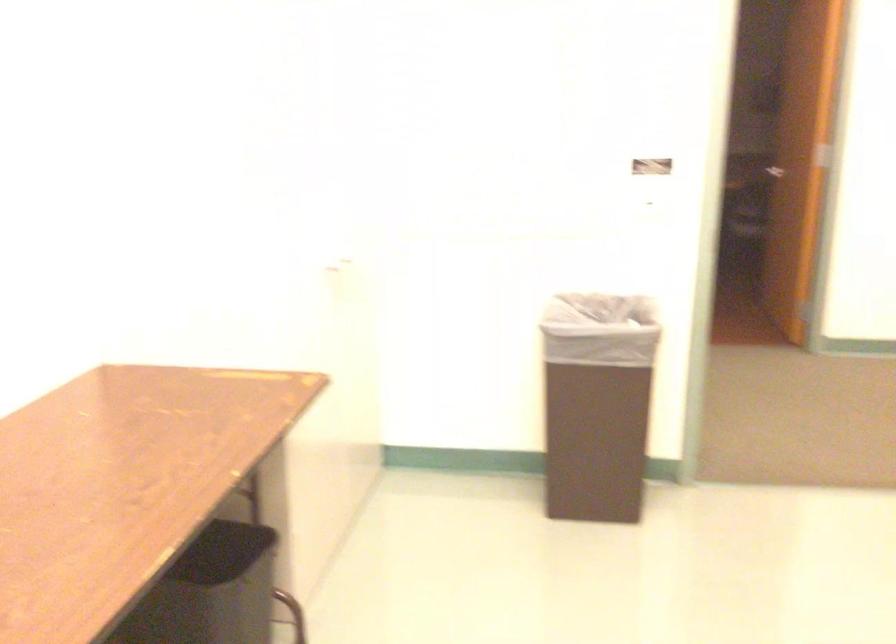
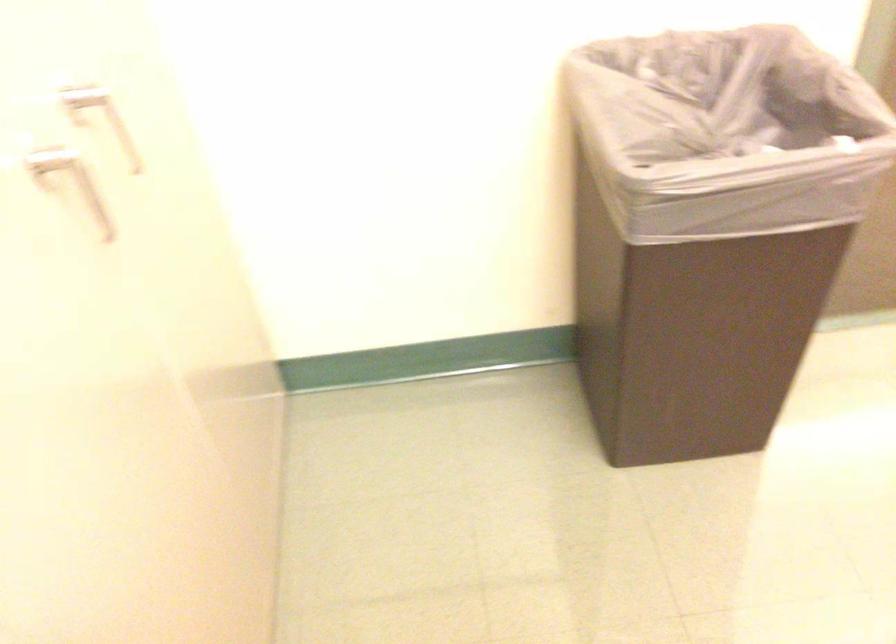
Question: Which direction would the cameraman need to move to produce the second image? Reply with the corresponding letter.

Choices:
 (A) Left
 (B) Right
 (C) Forward
 (D) Backward

Answer: (C)